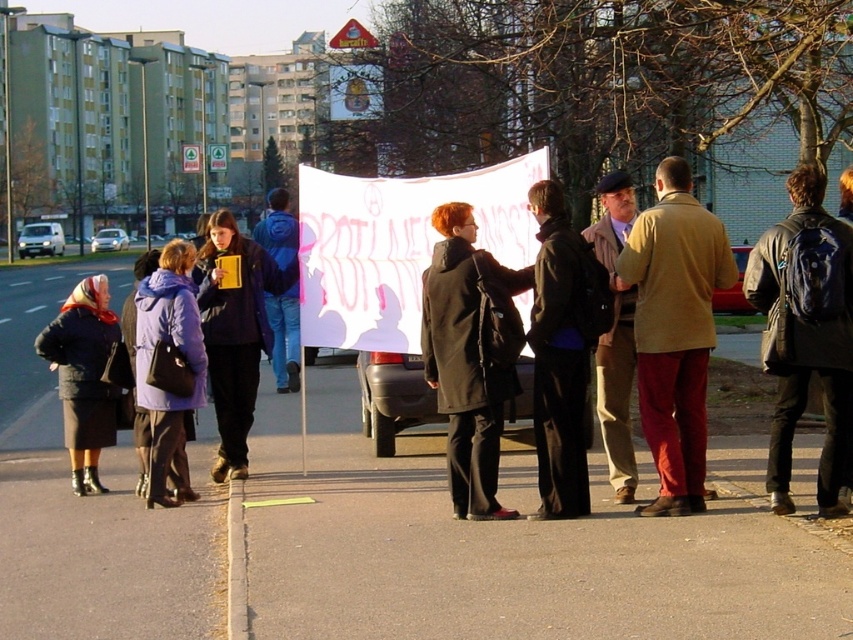
Question: Is purple fleece jacket at left positioned in front of brown leather jacket at center?

Choices:
 (A) no
 (B) yes

Answer: (A)

Question: Which point is closer to the camera?

Choices:
 (A) (138, 364)
 (B) (84, 435)
 (C) (701, 209)
 (D) (502, 380)

Answer: (C)

Question: Among these objects, which one is farthest from the camera?

Choices:
 (A) brown leather jacket at center
 (B) matte black coat at center

Answer: (A)

Question: Can you confirm if khaki woolen coat at center is smaller than matte black jacket at center?

Choices:
 (A) yes
 (B) no

Answer: (B)

Question: Is matte black coat at center above dark blue wool coat at left?

Choices:
 (A) yes
 (B) no

Answer: (A)

Question: Estimate the real-world distances between objects in this image. Which object is closer to the matte black jacket at center?

Choices:
 (A) khaki woolen coat at center
 (B) dark green coat at center

Answer: (B)